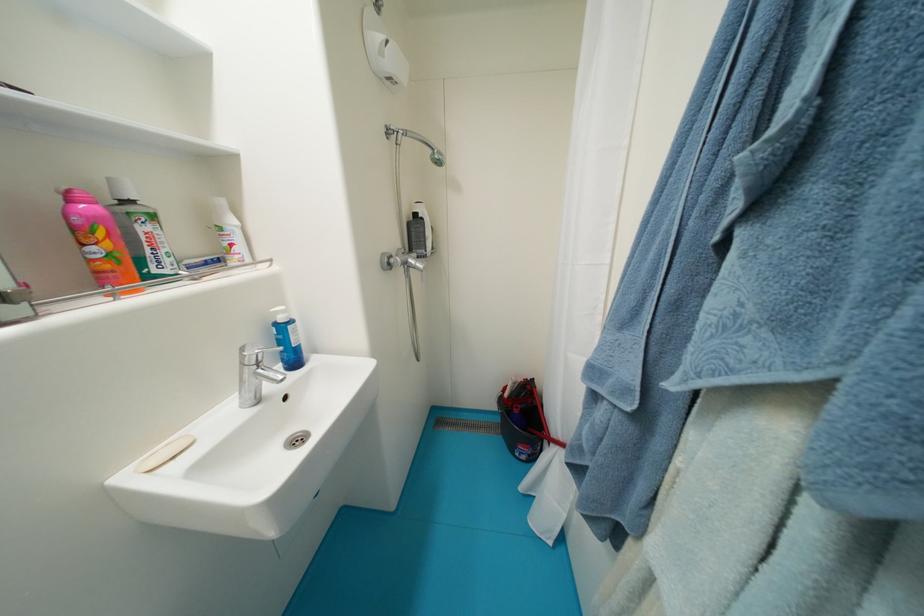
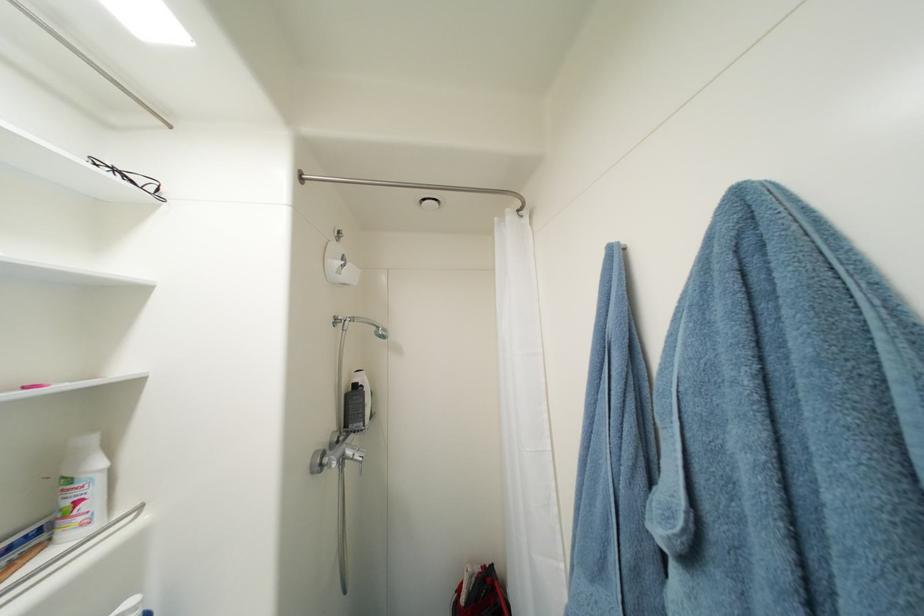
The point at (237, 246) is marked in the first image. Where is the corresponding point in the second image?

(84, 504)